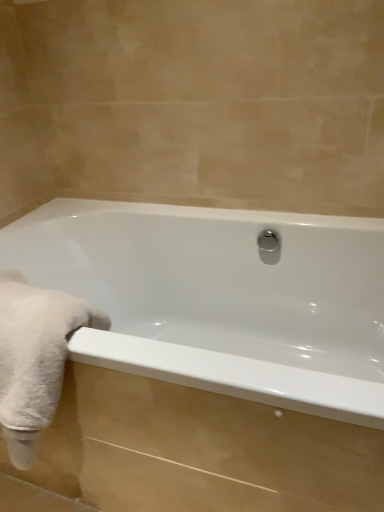
Question: Considering the positions of polished chrome shower at center and white glossy bathtub at center in the image, is polished chrome shower at center wider or thinner than white glossy bathtub at center?

Choices:
 (A) wide
 (B) thin

Answer: (B)

Question: In the image, is polished chrome shower at center on the left side or the right side of white glossy bathtub at center?

Choices:
 (A) left
 (B) right

Answer: (B)

Question: Estimate the real-world distances between objects in this image. Which object is farther from the white fluffy towel at left?

Choices:
 (A) polished chrome shower at center
 (B) white glossy bathtub at center

Answer: (A)

Question: Estimate the real-world distances between objects in this image. Which object is farther from the white glossy bathtub at center?

Choices:
 (A) white fluffy towel at left
 (B) polished chrome shower at center

Answer: (A)